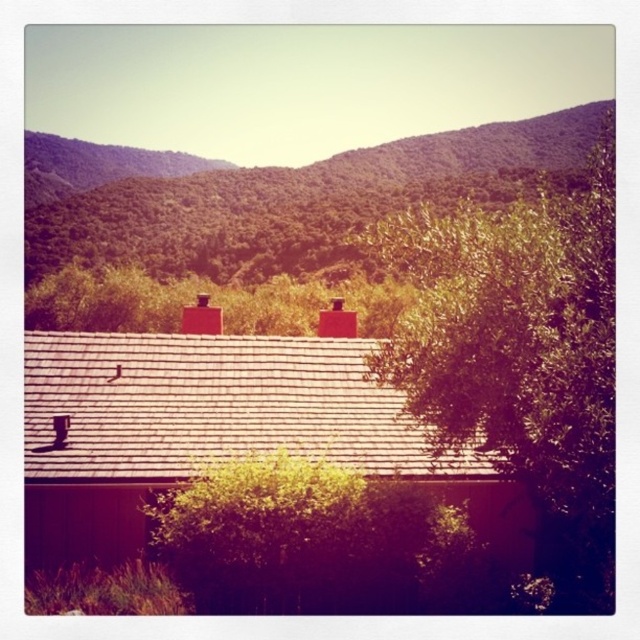
Does green leafy tree at right appear under green leafy tree at center?

No.

Between green leafy tree at right and green leafy tree at center, which one is positioned higher?

Positioned higher is green leafy tree at right.

This screenshot has width=640, height=640. I want to click on green leafy tree at right, so click(522, 352).

What do you see at coordinates (522, 352) in the screenshot? I see `green leafy tree at right` at bounding box center [522, 352].

This screenshot has width=640, height=640. What are the coordinates of `green leafy tree at right` in the screenshot? It's located at (522, 352).

Which is in front, point (582, 161) or point (307, 502)?

Point (307, 502) is more forward.

Is green leafy hillside at upper center in front of green leafy tree at center?

No, it is behind green leafy tree at center.

Image resolution: width=640 pixels, height=640 pixels. Describe the element at coordinates (296, 200) in the screenshot. I see `green leafy hillside at upper center` at that location.

This screenshot has height=640, width=640. Identify the location of green leafy hillside at upper center. (296, 200).